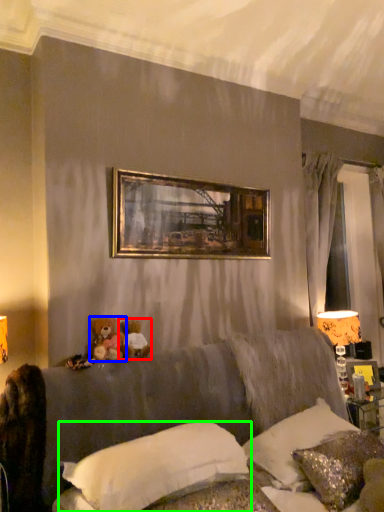
Question: Which object is the farthest from toy (highlighted by a red box)? Choose among these: toy (highlighted by a blue box) or pillow (highlighted by a green box).

Choices:
 (A) toy
 (B) pillow

Answer: (B)